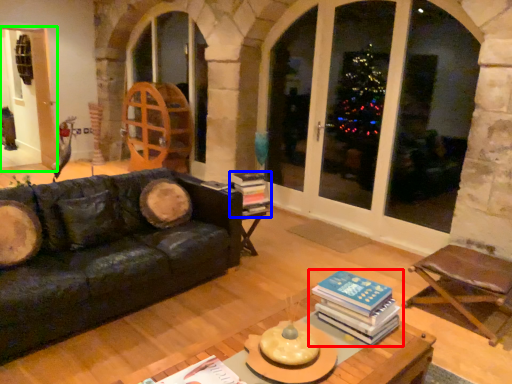
Question: Estimate the real-world distances between objects in this image. Which object is closer to book (highlighted by a red box), book (highlighted by a blue box) or screen door (highlighted by a green box)?

Choices:
 (A) book
 (B) screen door

Answer: (A)